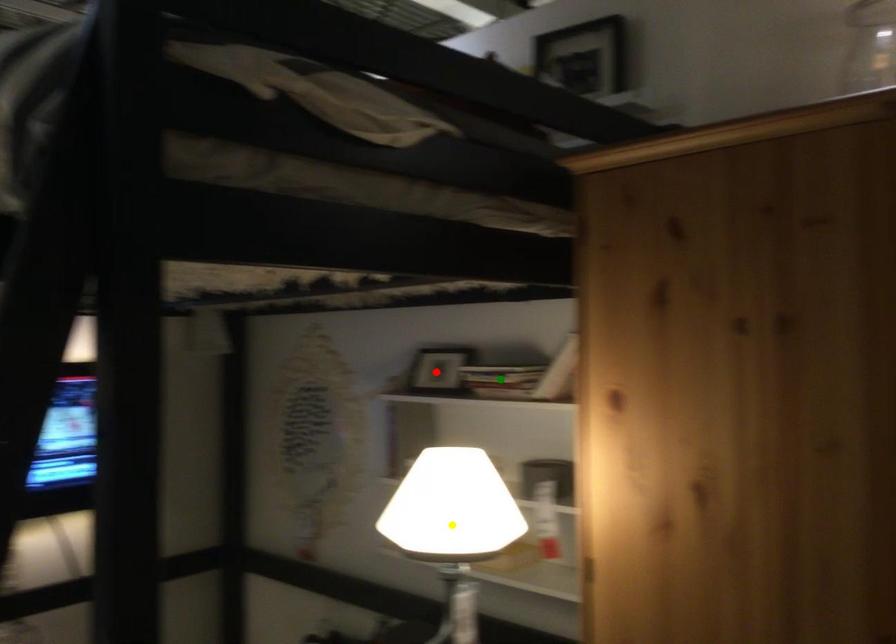
In the scene shown: Order these from farthest to nearest:
green point | red point | yellow point

red point → green point → yellow point